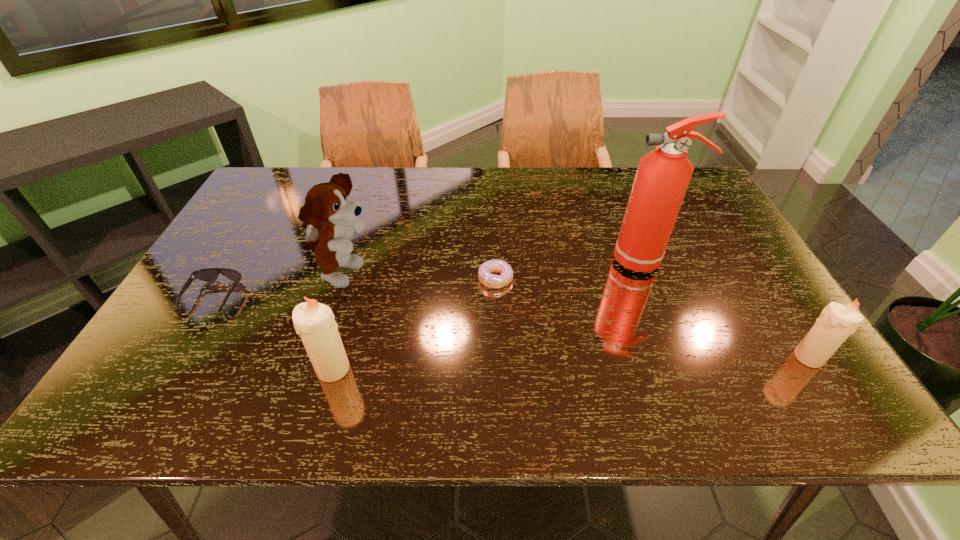
Locate an element on the screen. The width and height of the screenshot is (960, 540). vacant space at the far edge of the desktop is located at coordinates (604, 183).

In the image, there is a desktop. Where is `vacant space at the near edge`? vacant space at the near edge is located at coordinates (411, 355).

Find the location of `free space at the left edge of the desktop`. free space at the left edge of the desktop is located at coordinates (249, 246).

Identify the location of blank space at the far left corner. The image size is (960, 540). 275,192.

I want to click on vacant space at the near right corner of the desktop, so click(775, 367).

You are a GUI agent. You are given a task and a screenshot of the screen. Output one action in this format:
    pyautogui.click(x=<x>, y=<y>)
    Task: Click on the empty space between the fourth object from left to right and the leftmost object
    
    Given the screenshot: What is the action you would take?
    pyautogui.click(x=354, y=288)

The image size is (960, 540). Identify the location of vacant space that is in between the fire extinguisher and the right candle. [727, 309].

You are a GUI agent. You are given a task and a screenshot of the screen. Output one action in this format:
    pyautogui.click(x=<x>, y=<y>)
    Task: Click on the vacant space that's between the third object from right to left and the taller candle
    
    Given the screenshot: What is the action you would take?
    pyautogui.click(x=415, y=324)

At what (x,y) coordinates should I click in order to perform the action: click on vacant point located between the right candle and the sunglasses. Please return your answer as a coordinate pair (x, y). Looking at the image, I should click on (511, 328).

What are the coordinates of `unoccupied area between the shorter candle and the taller candle` in the screenshot? It's located at (570, 363).